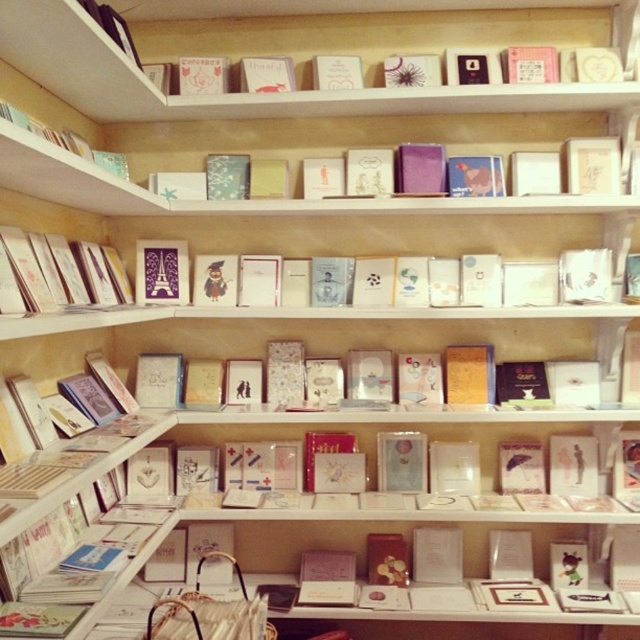
You are a customer in the shop and want to choose between the matte pink card at center and the matte pink card at upper center. Which one has a larger width?

The matte pink card at center might be wider than matte pink card at upper center.

You are a customer browsing the greeting cards in the shop. You see the matte pink card at center and the matte paper greeting card at left. Which card is closer to you?

The matte pink card at center is closer to you because it is further to the viewer than the matte paper greeting card at left.